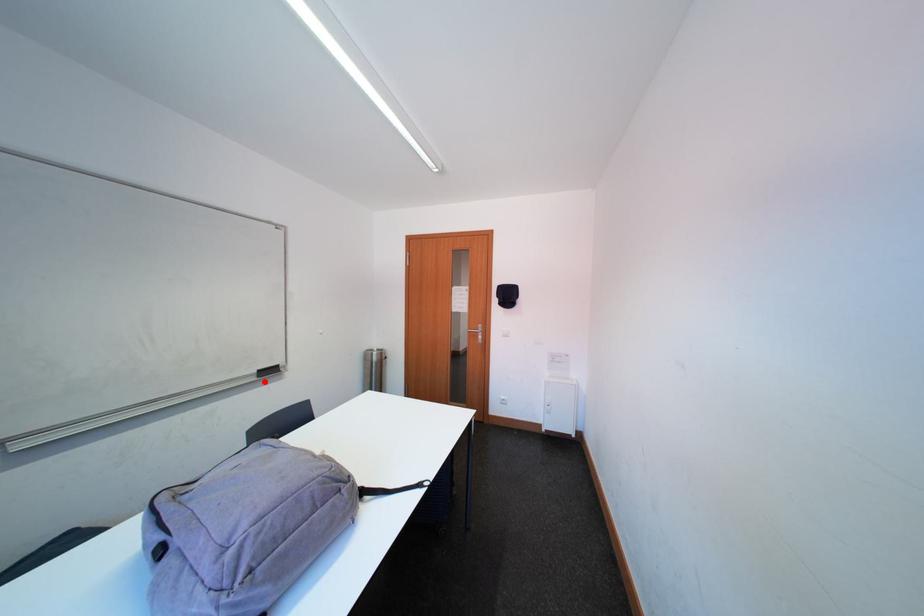
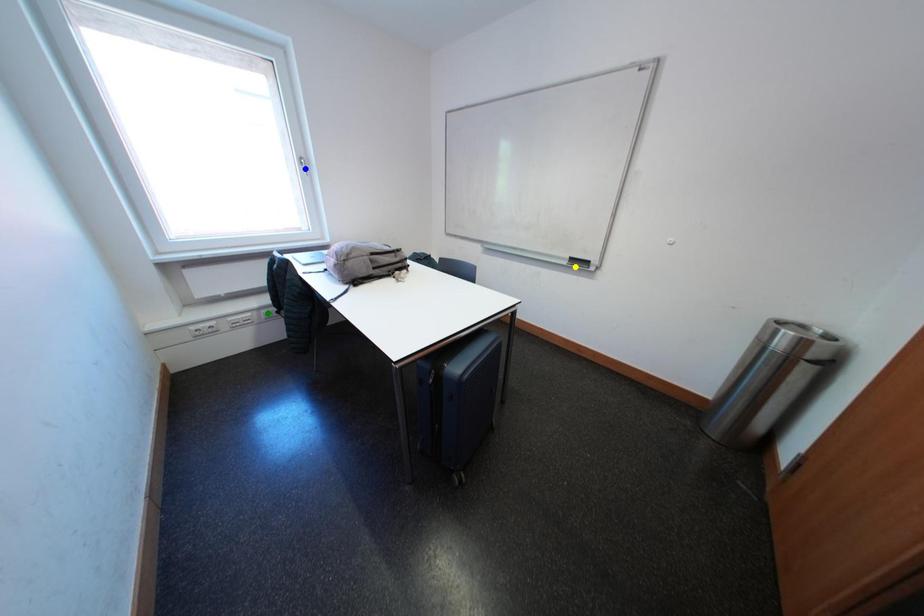
Question: I am providing you with two images of the same scene from different viewpoints. A red point is marked on the first image. You are given multiple points on the second image. Can you choose the point in image 2 that corresponds to the point in image 1?

Choices:
 (A) blue point
 (B) green point
 (C) yellow point

Answer: (C)